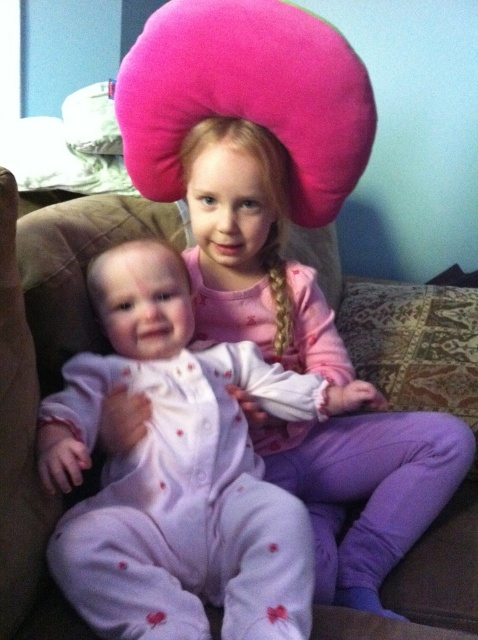
You are a photographer setting up for a family photo. You notice two sets of pajamas on the couch between the two children. The pajamas are labeled as matte pink pajamas at center and pink soft pajamas at center. Which set of pajamas is positioned to the left of the other?

The matte pink pajamas at center is to the left of pink soft pajamas at center.

From the picture: You are a parent trying to put your child in pajamas. There are two options at the center of the image, the matte pink pajamas at center and the pink soft pajamas at center. Which one is closer to the other?

The matte pink pajamas at center is 6.66 inches from pink soft pajamas at center, so they are both at the center and the distance between them is 6.66 inches.

You are a photographer trying to capture a closeup of the older child in the pink shirt. You notice two points marked in the image. The first point is at coordinate point (75, 458) and the second is at point (205, 241). Which point is closer to the older child in pink long sleeved shirt and purple pants?

Point (75, 458) is closer to the older child in pink long sleeved shirt and purple pants because it is in front of point (205, 241).